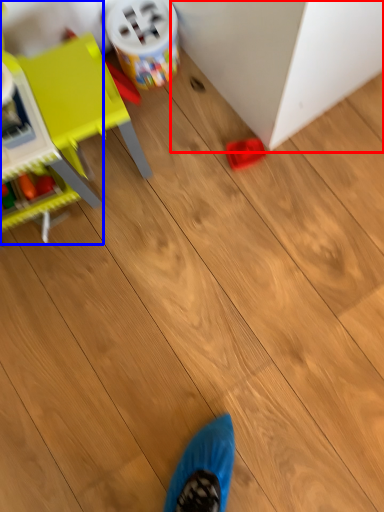
Question: Among these objects, which one is nearest to the camera, furniture (highlighted by a red box) or toy (highlighted by a blue box)?

Choices:
 (A) furniture
 (B) toy

Answer: (B)